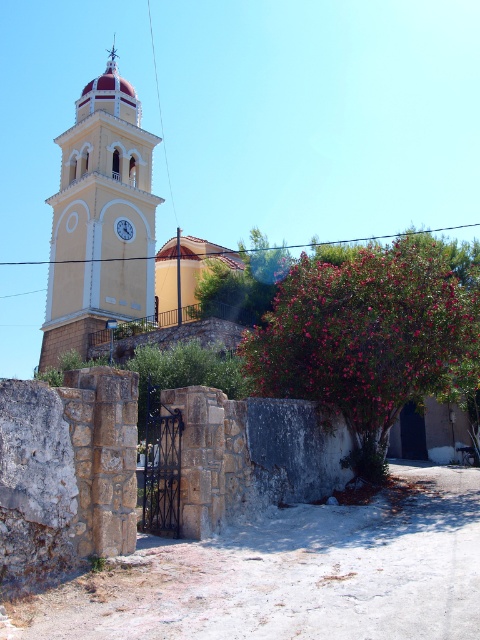
Question: Which point is farther from the camera taking this photo?

Choices:
 (A) (96, 310)
 (B) (121, 237)

Answer: (B)

Question: Which of the following is the closest to the observer?

Choices:
 (A) white glossy clock at upper center
 (B) matte yellow clock tower at center

Answer: (B)

Question: Is matte yellow clock tower at center in front of white glossy clock at upper center?

Choices:
 (A) yes
 (B) no

Answer: (A)

Question: From the image, what is the correct spatial relationship of matte yellow clock tower at center in relation to white glossy clock at upper center?

Choices:
 (A) left
 (B) right

Answer: (A)

Question: Is matte yellow clock tower at center smaller than white glossy clock at upper center?

Choices:
 (A) yes
 (B) no

Answer: (B)